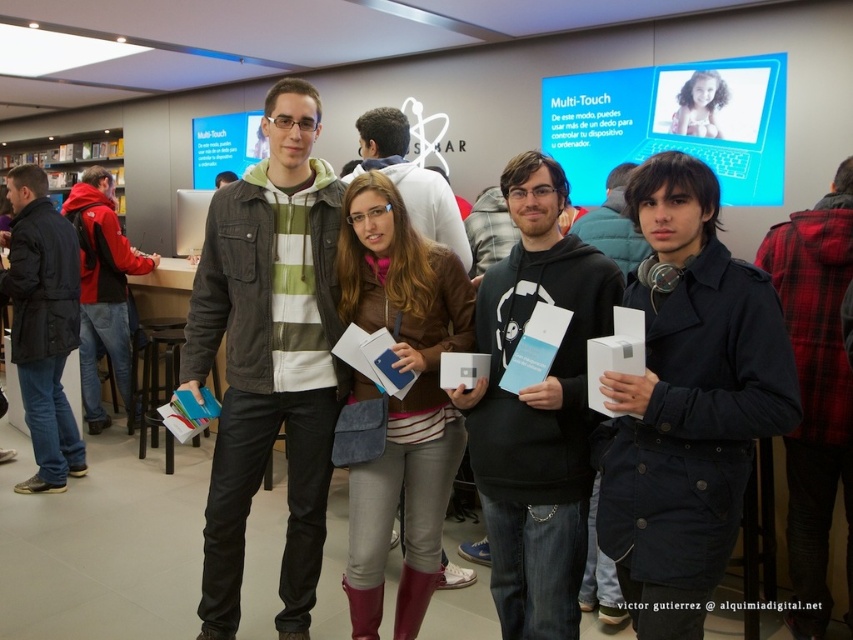
You are standing in front of the four people at the tech event. There are two points marked in the image. One is at coordinate point (624, 532) and the other is at point (65, 202). Which of these two points is closer to you?

Point (624, 532) is closer to you than point (65, 202).

You are a photographer trying to capture a group photo of the dark blue cotton coat at center and the matte black jacket at center. Which one should you focus on first if you want to capture them both in the frame?

You should focus on the matte black jacket at center first because it is positioned on the left side of the dark blue cotton coat at center, so adjusting focus from left to right would ensure both are captured.